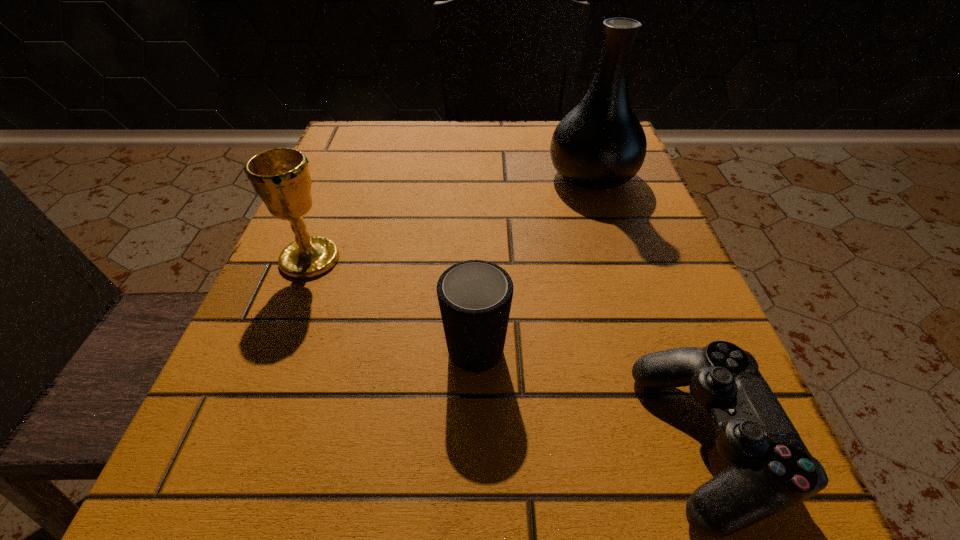
You are a GUI agent. You are given a task and a screenshot of the screen. Output one action in this format:
    pyautogui.click(x=<x>, y=<y>)
    Task: Click on the vase
    This screenshot has height=540, width=960.
    Given the screenshot: What is the action you would take?
    pyautogui.click(x=600, y=144)

You are a GUI agent. You are given a task and a screenshot of the screen. Output one action in this format:
    pyautogui.click(x=<x>, y=<y>)
    Task: Click on the farthest object
    
    Given the screenshot: What is the action you would take?
    pyautogui.click(x=600, y=144)

In order to click on chalice in this screenshot , I will do `click(281, 178)`.

Find the location of `the second tallest object`. the second tallest object is located at coordinates (281, 178).

Locate an element on the screen. The width and height of the screenshot is (960, 540). the third object from right to left is located at coordinates (475, 296).

Locate an element on the screen. mug is located at coordinates (475, 296).

Where is `vacant area situated on the front of the vase`? This screenshot has width=960, height=540. vacant area situated on the front of the vase is located at coordinates (633, 301).

This screenshot has height=540, width=960. What are the coordinates of `vacant region located 0.220m on the right of the second tallest object` in the screenshot? It's located at (473, 259).

In order to click on free spot located 0.060m on the side of the mug with the handle in this screenshot , I will do `click(476, 276)`.

The width and height of the screenshot is (960, 540). What are the coordinates of `free space located on the side of the mug with the handle` in the screenshot? It's located at (476, 276).